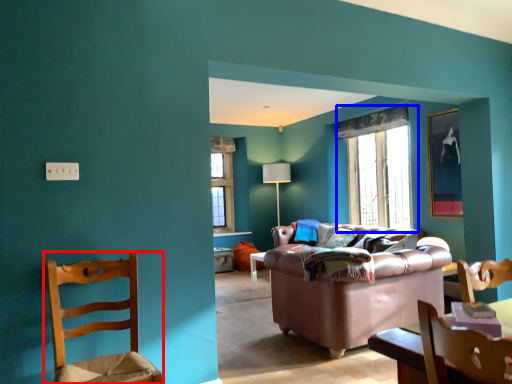
Question: Which of the following is the closest to the observer, chair (highlighted by a red box) or window (highlighted by a blue box)?

Choices:
 (A) chair
 (B) window

Answer: (A)